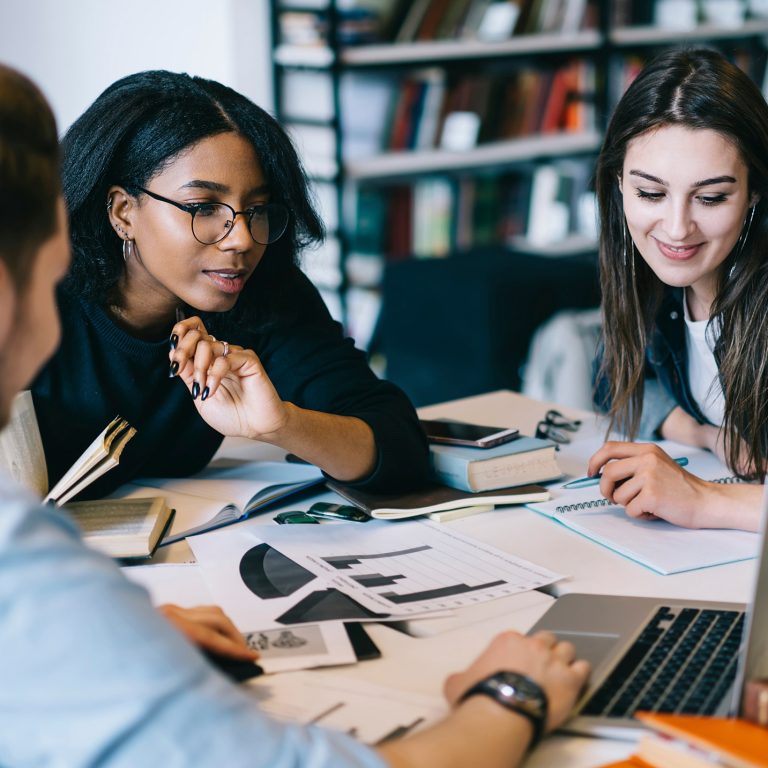
The height and width of the screenshot is (768, 768). What are the coordinates of `shelving` in the screenshot? It's located at (343, 58).